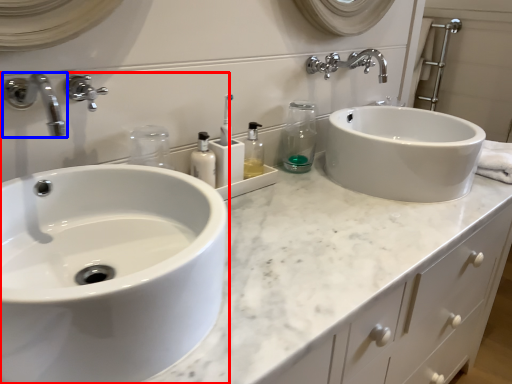
Question: Among these objects, which one is nearest to the camera, sink (highlighted by a red box) or tap (highlighted by a blue box)?

Choices:
 (A) sink
 (B) tap

Answer: (A)